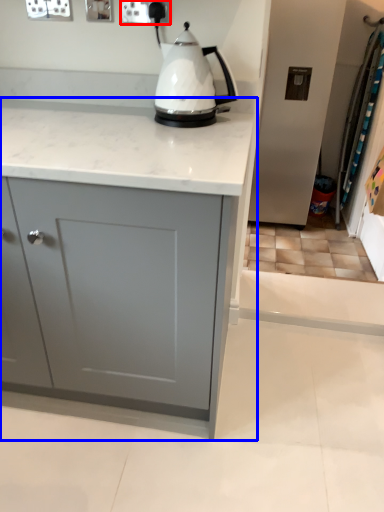
Question: Which object appears farthest to the camera in this image, electric outlet (highlighted by a red box) or cabinetry (highlighted by a blue box)?

Choices:
 (A) electric outlet
 (B) cabinetry

Answer: (A)